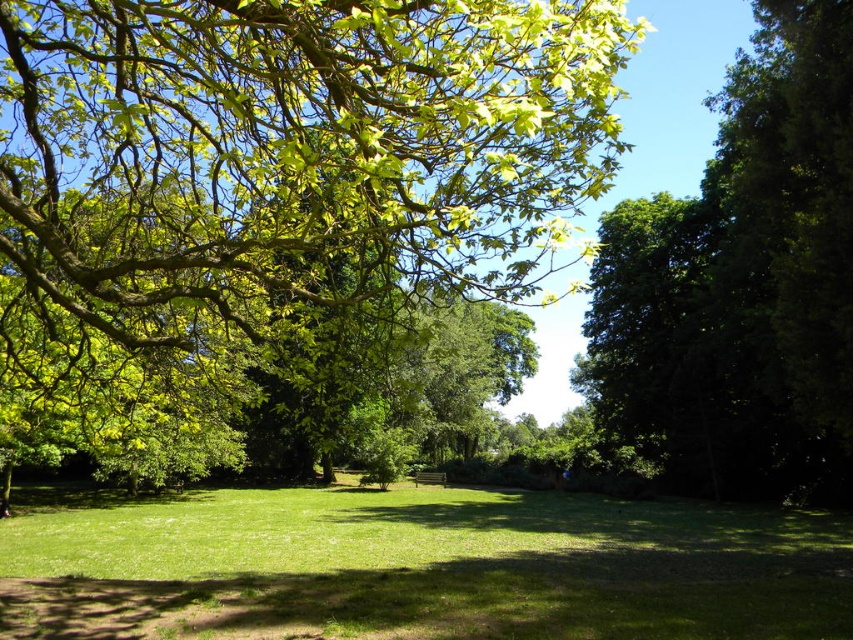
Question: Based on their relative distances, which object is nearer to the dark green leafy tree at right?

Choices:
 (A) green grassy field at center
 (B) green leafy tree at upper center

Answer: (A)

Question: Among these points, which one is nearest to the camera?

Choices:
 (A) (674, 579)
 (B) (357, 202)
 (C) (799, 164)

Answer: (B)

Question: Is green grassy field at center above dark green leafy tree at right?

Choices:
 (A) yes
 (B) no

Answer: (B)

Question: Does green leafy tree at upper center come in front of green grassy field at center?

Choices:
 (A) no
 (B) yes

Answer: (B)

Question: Does green leafy tree at upper center lie in front of green grassy field at center?

Choices:
 (A) no
 (B) yes

Answer: (B)

Question: Estimate the real-world distances between objects in this image. Which object is closer to the dark green leafy tree at right?

Choices:
 (A) green leafy tree at upper center
 (B) green grassy field at center

Answer: (B)